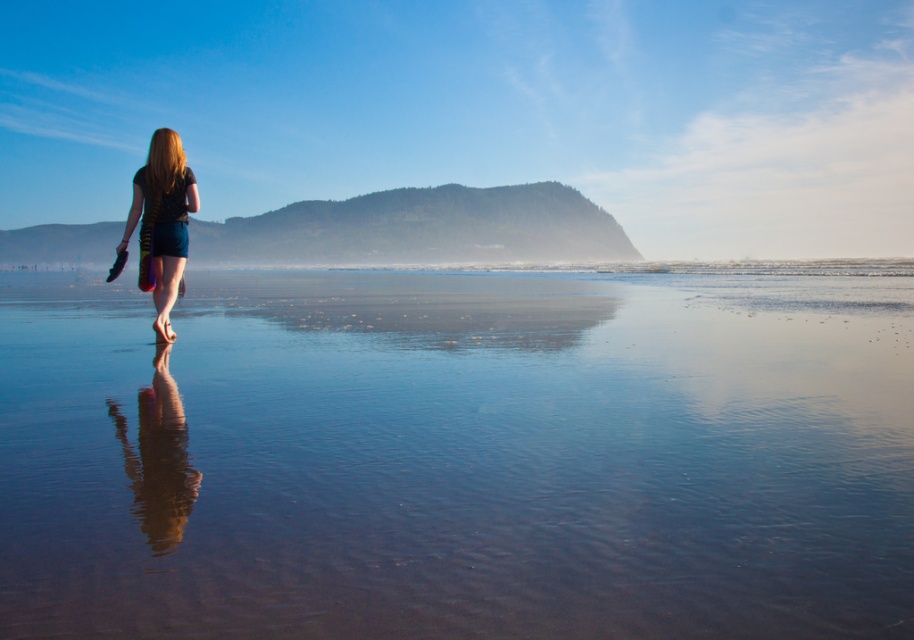
Question: Is clear water at center below matte black shorts at center?

Choices:
 (A) yes
 (B) no

Answer: (A)

Question: Can you confirm if clear water at center is smaller than matte black shorts at center?

Choices:
 (A) yes
 (B) no

Answer: (B)

Question: Which point is farther from the camera taking this photo?

Choices:
 (A) (160, 205)
 (B) (295, 412)

Answer: (A)

Question: Considering the relative positions of clear water at center and matte black shorts at center in the image provided, where is clear water at center located with respect to matte black shorts at center?

Choices:
 (A) above
 (B) below

Answer: (B)